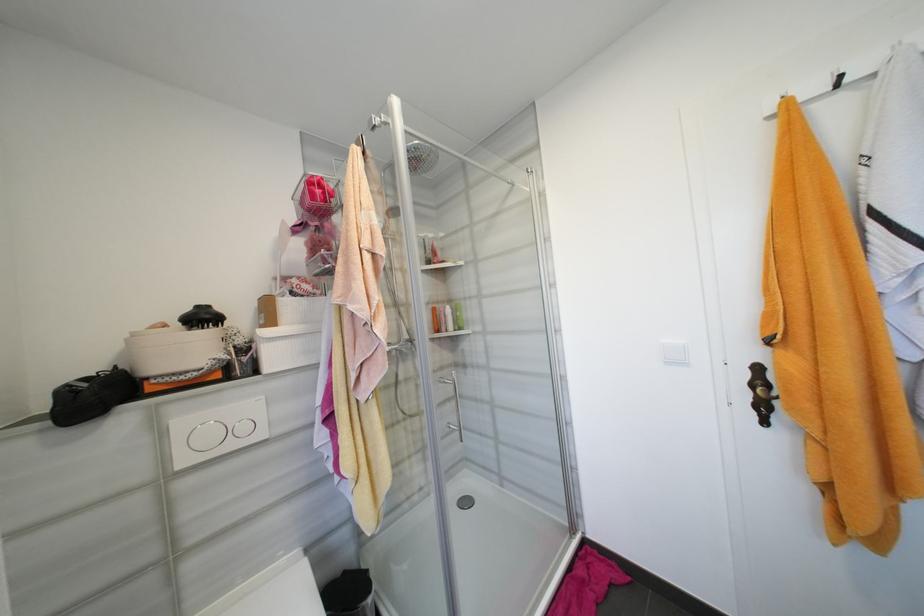
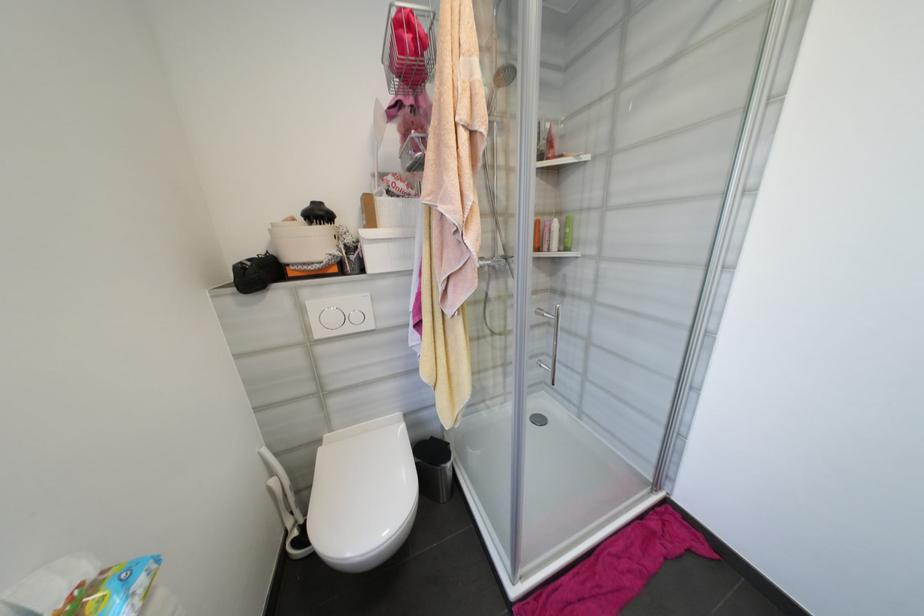
Find the pixel in the second image that matches pixel 450 330 in the first image.

(551, 249)